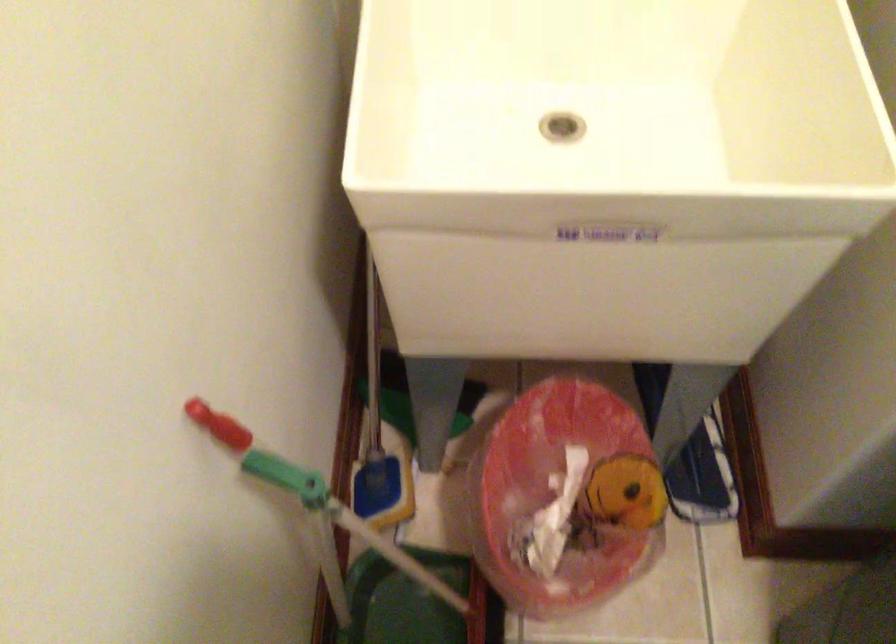
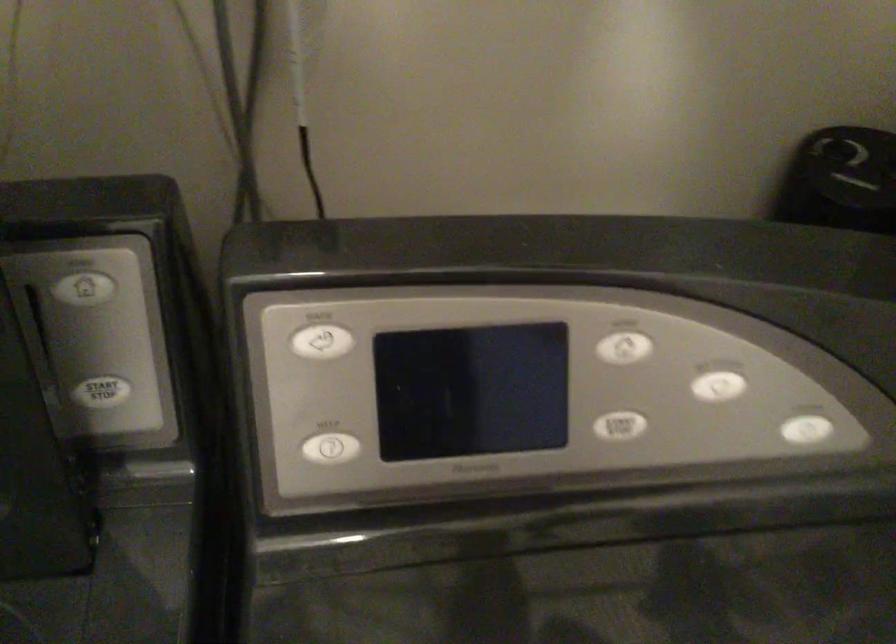
First-person continuous shooting, in which direction is the camera rotating?

The camera rotated toward right-down.